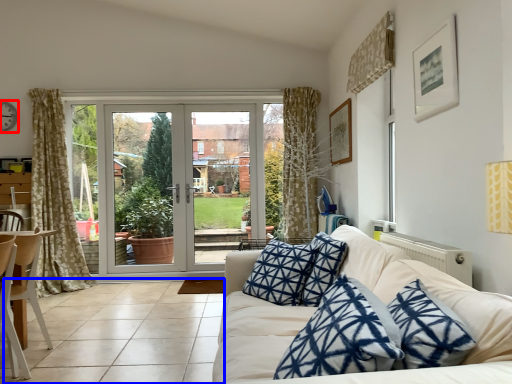
Question: Which point is closer to the camera, clock (highlighted by a red box) or tile (highlighted by a blue box)?

Choices:
 (A) clock
 (B) tile

Answer: (B)